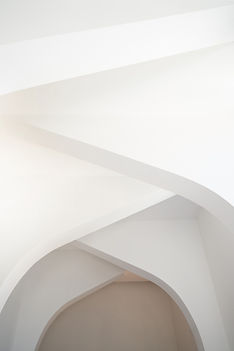
Locate an element on the screen. Image resolution: width=234 pixels, height=351 pixels. edge of second highest shelf is located at coordinates (169, 185).